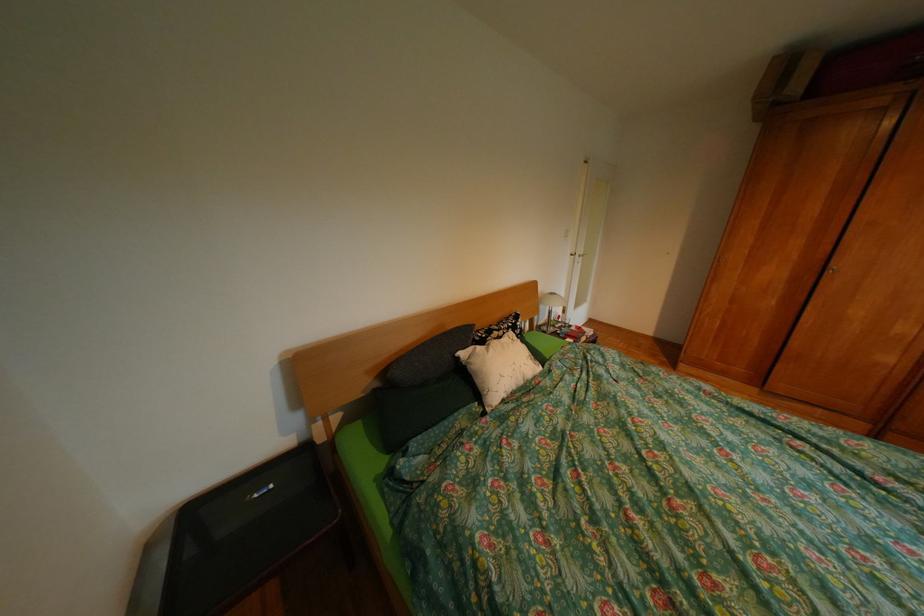
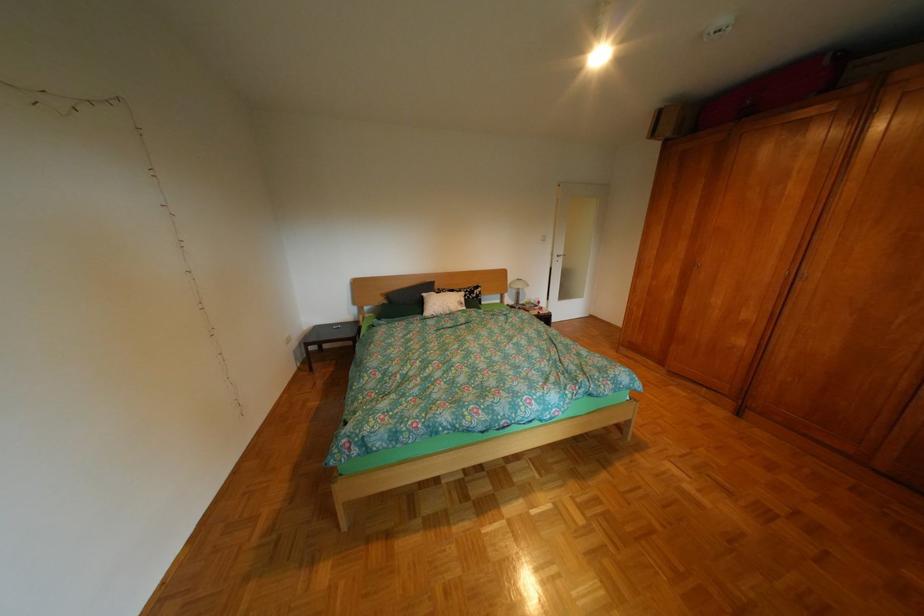
Locate, in the second image, the point that corresponds to (x=477, y=354) in the first image.

(439, 294)